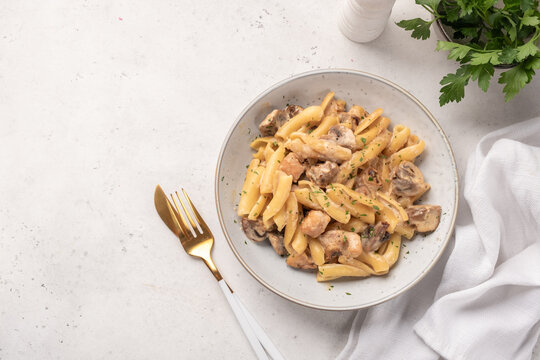
This screenshot has width=540, height=360. Identify the location of shadow underneath the bowl of pasta. point(330,321), point(423,298), point(465,209).